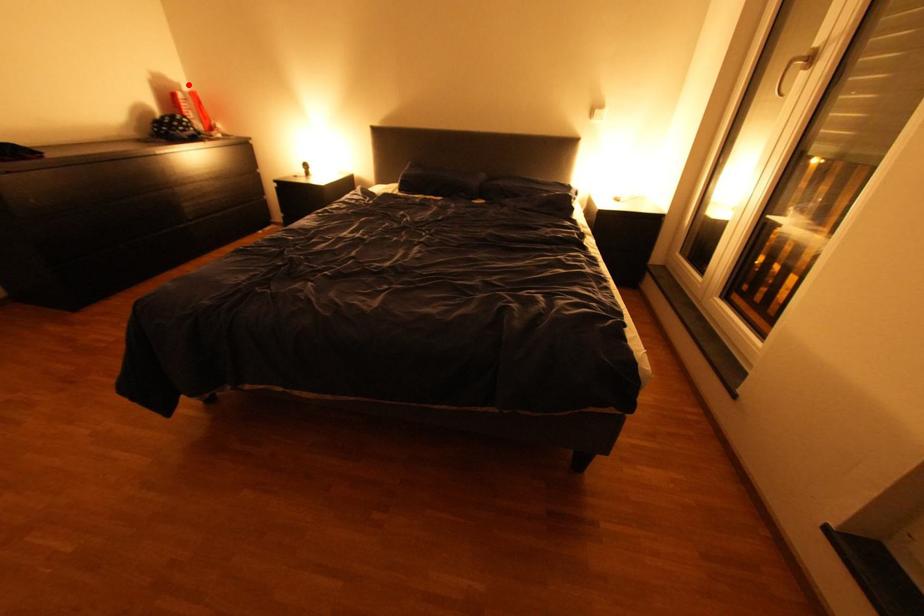
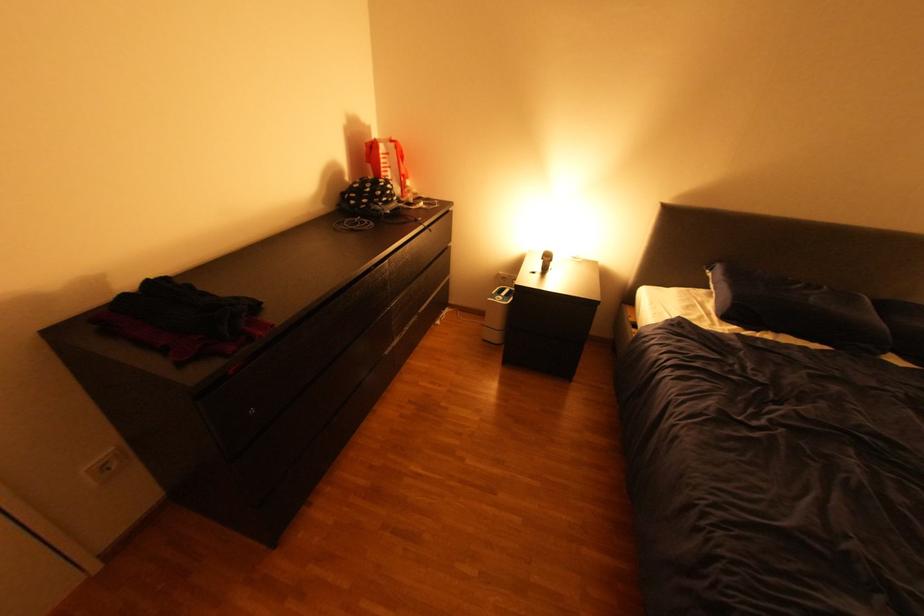
In the second image, find the point that corresponds to the highlighted location in the first image.

(379, 129)